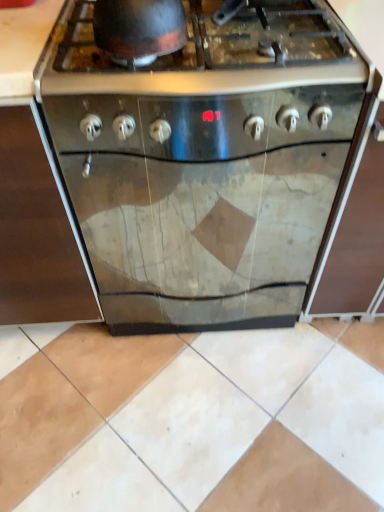
Identify the location of free spot above beige ceramic tile at lower center (from a real-world perspective). The height and width of the screenshot is (512, 384). (204, 393).